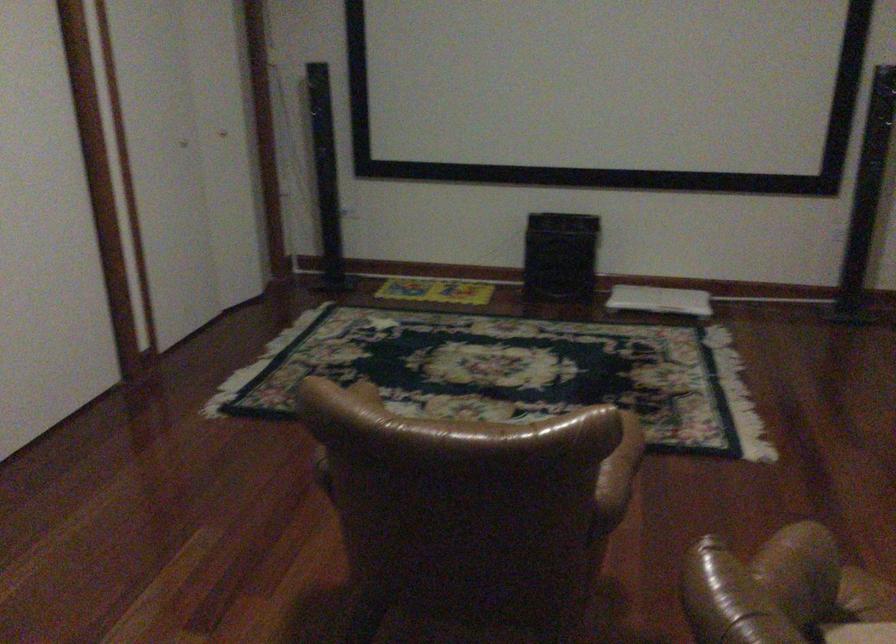
Where is `brown leather armrest`? Image resolution: width=896 pixels, height=644 pixels. brown leather armrest is located at coordinates (622, 460).